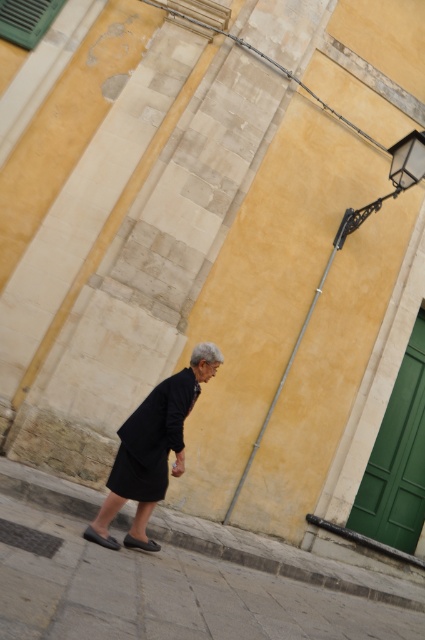
Question: Is black wrought iron streetlight at upper right closer to the viewer compared to black leather sandal at lower center?

Choices:
 (A) no
 (B) yes

Answer: (A)

Question: Which point appears closest to the camera in this image?

Choices:
 (A) (74, 529)
 (B) (166, 380)

Answer: (A)

Question: Observing the image, what is the correct spatial positioning of metallic black streetlamp at right in reference to black wrought iron streetlight at upper right?

Choices:
 (A) left
 (B) right

Answer: (B)

Question: Which is nearer to the black wrought iron streetlight at upper right?

Choices:
 (A) gray concrete pavement at lower center
 (B) black leather sandal at lower center
 (C) metallic black streetlamp at right

Answer: (C)

Question: Does black wrought iron streetlight at upper right come in front of matte black sandal at lower left?

Choices:
 (A) no
 (B) yes

Answer: (A)

Question: Which point is farther from the camera taking this photo?

Choices:
 (A) (396, 164)
 (B) (180, 554)

Answer: (A)